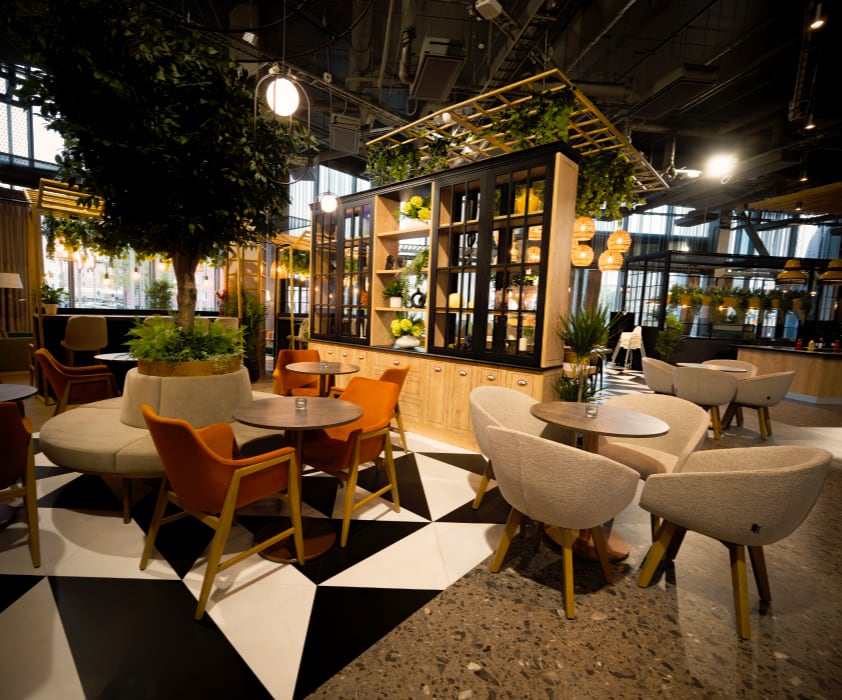
Find the location of a particular element. This screenshot has height=700, width=842. lights is located at coordinates (270, 102), (715, 162), (448, 117), (812, 120), (802, 175), (813, 19), (785, 260), (829, 267), (275, 258), (306, 276).